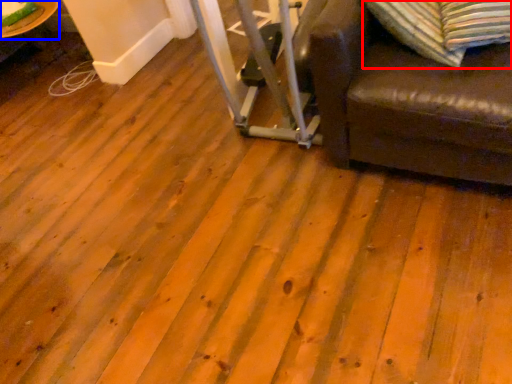
Question: Among these objects, which one is nearest to the camera, pillow (highlighted by a red box) or table (highlighted by a blue box)?

Choices:
 (A) pillow
 (B) table

Answer: (A)